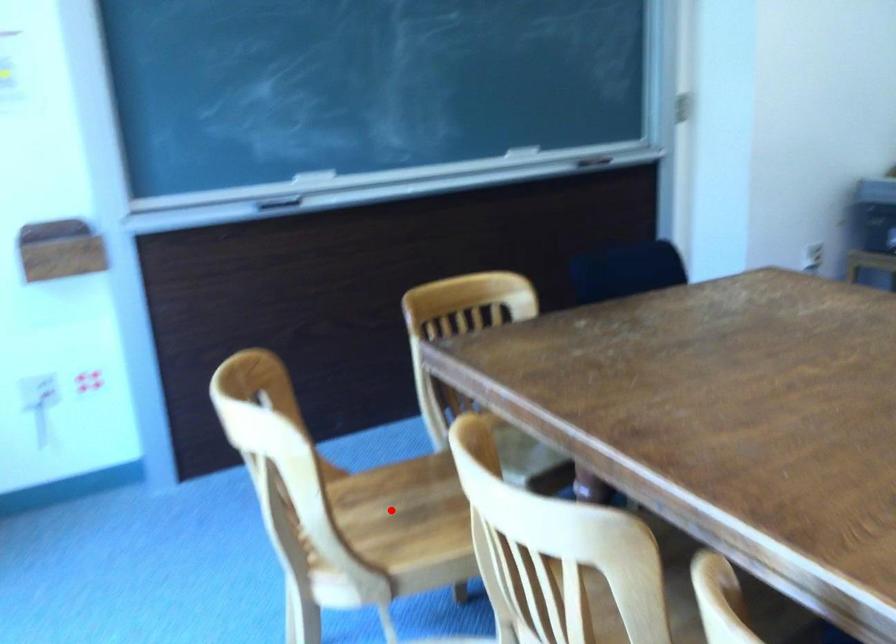
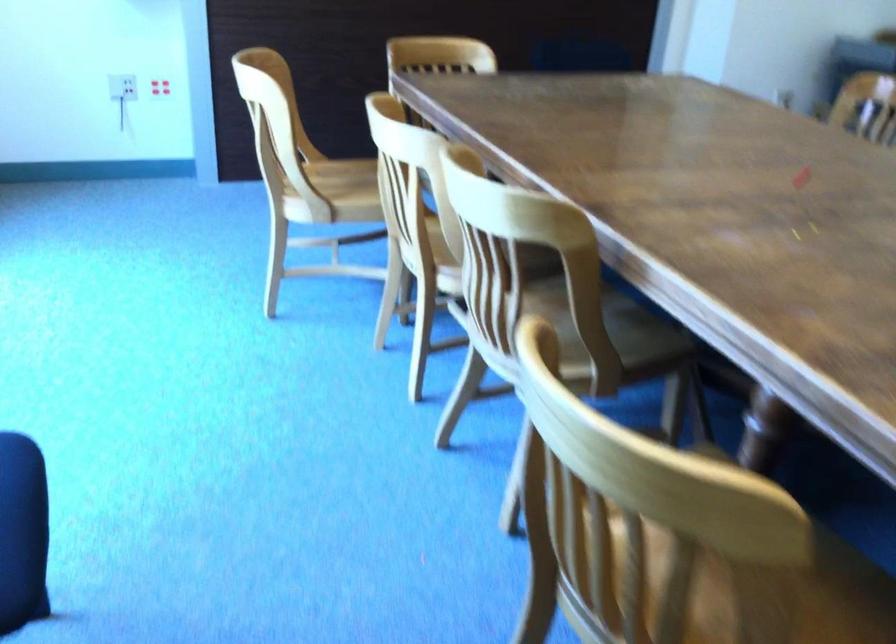
Question: I am providing you with two images of the same scene from different viewpoints. In image1, a red point is highlighted. Considering the same 3D point in image2, which of the following is correct?

Choices:
 (A) It is closer
 (B) It is farther

Answer: (B)